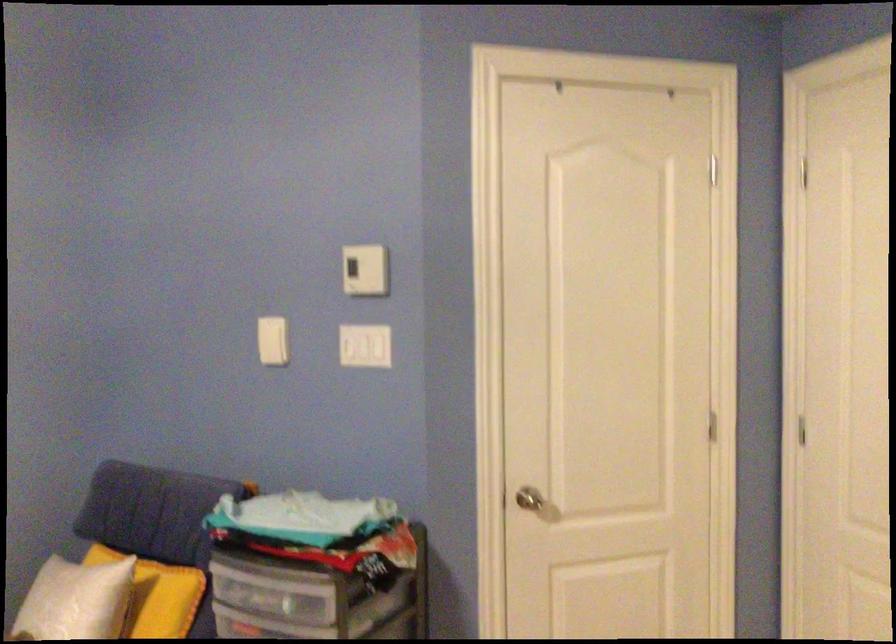
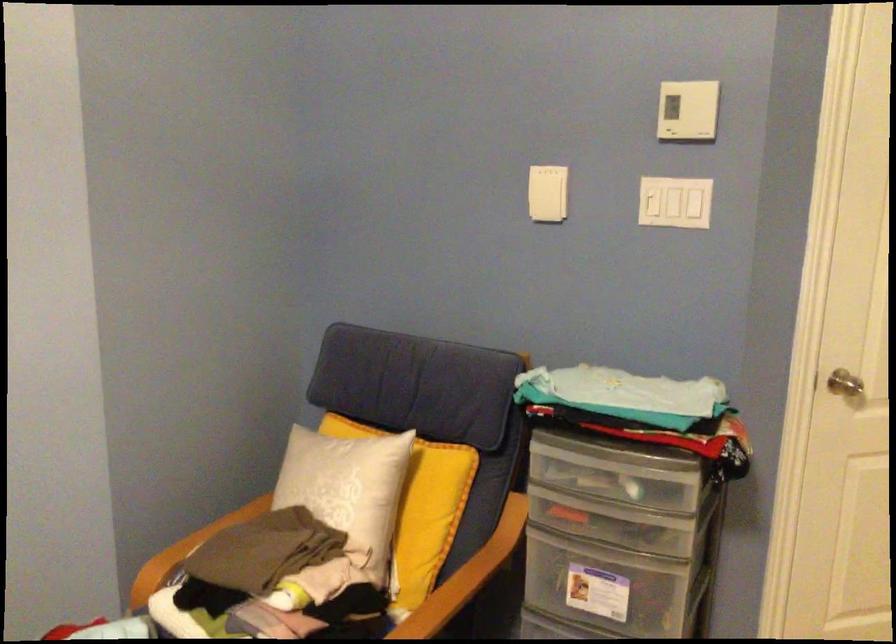
Find the pixel in the second image that matches pixel 264 351 in the first image.

(543, 201)